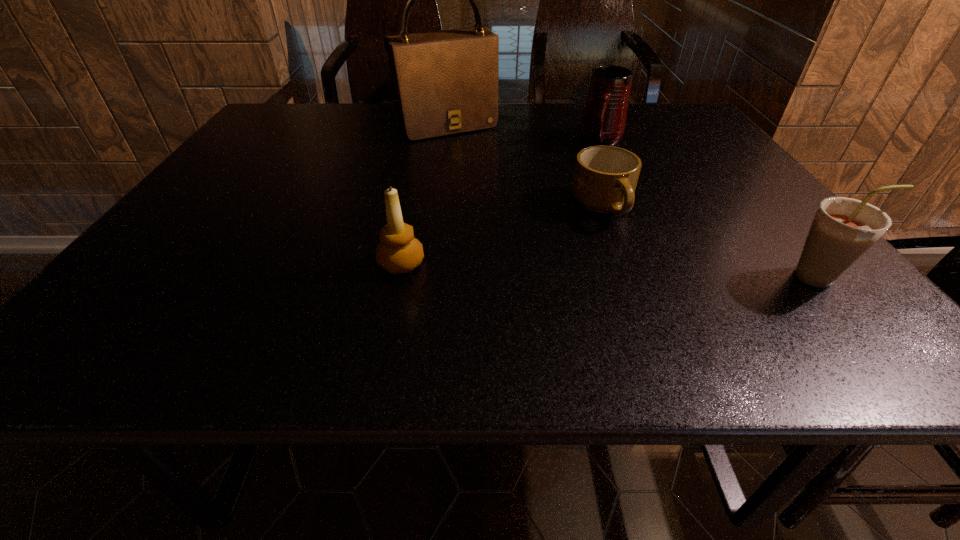
This screenshot has height=540, width=960. Identify the location of vacant area in the image that satisfies the following two spatial constraints: 1. on the front side of the shortest object; 2. on the left side of the tallest object. (436, 207).